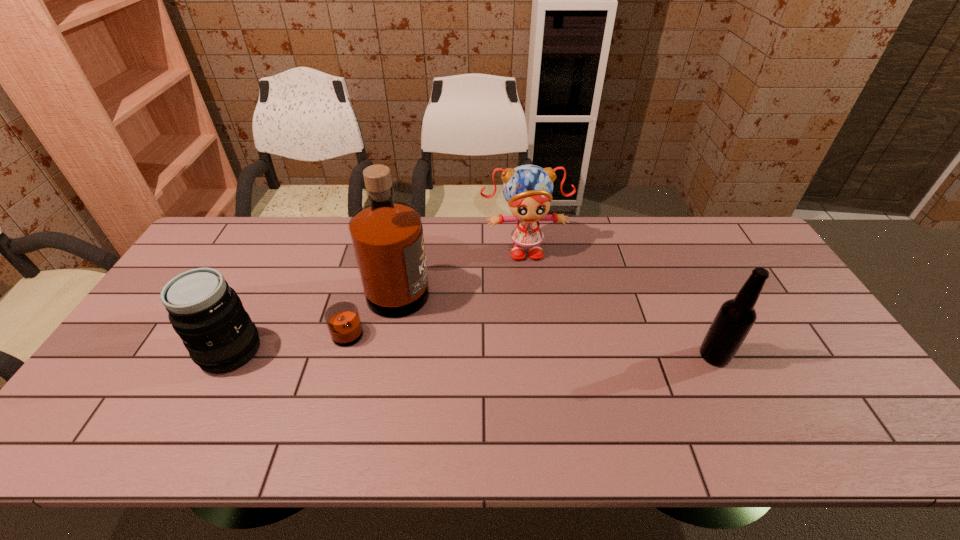
The width and height of the screenshot is (960, 540). What are the coordinates of `vacant space located on the front label of the liquor` in the screenshot? It's located at (445, 341).

Image resolution: width=960 pixels, height=540 pixels. What are the coordinates of `vacant space located on the front label of the liquor` in the screenshot? It's located at (525, 380).

Where is `free space located 0.050m on the face of the third object from left to right`? free space located 0.050m on the face of the third object from left to right is located at coordinates (529, 274).

Identify the location of blank area located 0.260m on the face of the third object from left to right. (539, 325).

Where is `free space located 0.380m on the face of the third object from left to right`? This screenshot has width=960, height=540. free space located 0.380m on the face of the third object from left to right is located at coordinates (545, 360).

At what (x,y) coordinates should I click in order to perform the action: click on object that is at the far edge. Please return your answer as a coordinate pair (x, y). The width and height of the screenshot is (960, 540). Looking at the image, I should click on (528, 189).

This screenshot has width=960, height=540. I want to click on free space at the far edge, so click(502, 252).

Where is `vacant space at the near edge of the desktop`? Image resolution: width=960 pixels, height=540 pixels. vacant space at the near edge of the desktop is located at coordinates tap(256, 381).

In the image, there is a desktop. Find the location of `free space at the left edge`. free space at the left edge is located at coordinates (168, 364).

The height and width of the screenshot is (540, 960). I want to click on vacant area at the right edge, so click(x=837, y=357).